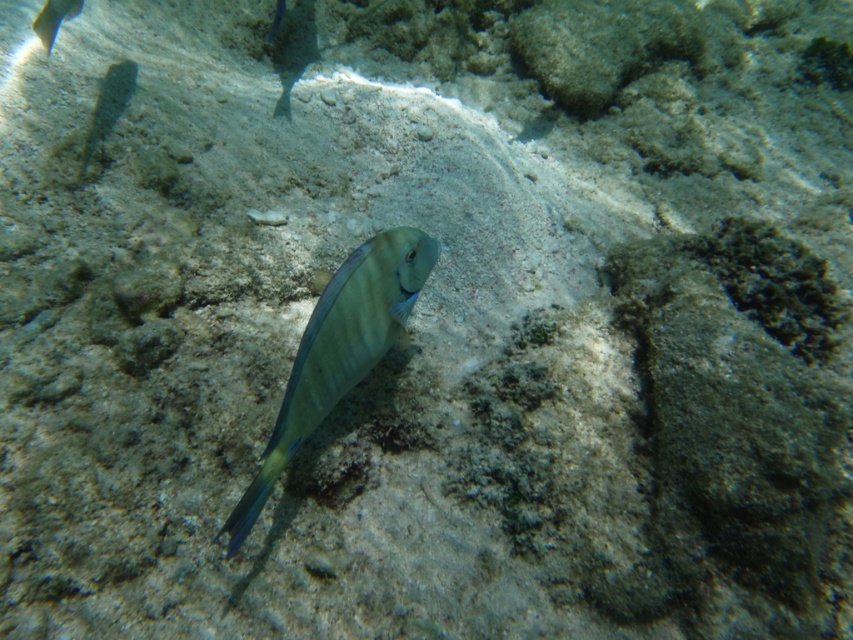
Question: Is shiny blue fish at center to the left of shiny blue fish at upper left from the viewer's perspective?

Choices:
 (A) no
 (B) yes

Answer: (A)

Question: Which object appears closest to the camera in this image?

Choices:
 (A) shiny blue fish at upper left
 (B) shiny blue fish at center

Answer: (B)

Question: Does shiny blue fish at center have a greater width compared to shiny blue fish at upper left?

Choices:
 (A) yes
 (B) no

Answer: (A)

Question: Among these points, which one is nearest to the camera?

Choices:
 (A) (48, 13)
 (B) (339, 276)

Answer: (B)

Question: Does shiny blue fish at center appear over shiny blue fish at upper left?

Choices:
 (A) no
 (B) yes

Answer: (A)

Question: Which object is farther from the camera taking this photo?

Choices:
 (A) shiny blue fish at center
 (B) shiny blue fish at upper left

Answer: (B)